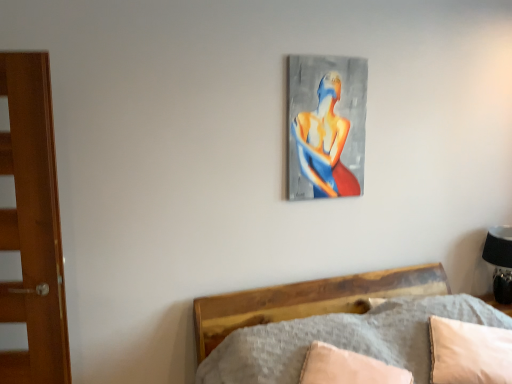
Question: Should I look upward or downward to see abstract painting at upper center?

Choices:
 (A) up
 (B) down

Answer: (A)

Question: Can you confirm if abstract painting at upper center is taller than beige fabric pillow at lower right, arranged as the first pillow when viewed from the left?

Choices:
 (A) yes
 (B) no

Answer: (A)

Question: Considering the relative sizes of abstract painting at upper center and beige fabric pillow at lower right, arranged as the second pillow when viewed from the right, in the image provided, is abstract painting at upper center smaller than beige fabric pillow at lower right, arranged as the second pillow when viewed from the right,?

Choices:
 (A) no
 (B) yes

Answer: (B)

Question: Could you tell me if abstract painting at upper center is turned towards beige fabric pillow at lower right, arranged as the first pillow when viewed from the left?

Choices:
 (A) yes
 (B) no

Answer: (B)

Question: From a real-world perspective, does abstract painting at upper center stand above beige fabric pillow at lower right, arranged as the first pillow when viewed from the left?

Choices:
 (A) no
 (B) yes

Answer: (B)

Question: Is abstract painting at upper center positioned with its back to beige fabric pillow at lower right, arranged as the first pillow when viewed from the left?

Choices:
 (A) no
 (B) yes

Answer: (A)

Question: Is abstract painting at upper center positioned behind beige fabric pillow at lower right, arranged as the first pillow when viewed from the left?

Choices:
 (A) yes
 (B) no

Answer: (A)

Question: Is black matte table lamp at right located within beige fabric pillow at lower right, which is counted as the second pillow, starting from the left?

Choices:
 (A) no
 (B) yes

Answer: (A)

Question: From the image's perspective, is beige fabric pillow at lower right, which is counted as the second pillow, starting from the left, on black matte table lamp at right?

Choices:
 (A) yes
 (B) no

Answer: (B)

Question: Does beige fabric pillow at lower right, which appears as the 1th pillow when viewed from the right, have a lesser height compared to black matte table lamp at right?

Choices:
 (A) no
 (B) yes

Answer: (B)

Question: Is black matte table lamp at right at the back of beige fabric pillow at lower right, which is counted as the second pillow, starting from the left?

Choices:
 (A) yes
 (B) no

Answer: (A)

Question: From the image's perspective, is beige fabric pillow at lower right, which appears as the 1th pillow when viewed from the right, under black matte table lamp at right?

Choices:
 (A) no
 (B) yes

Answer: (B)

Question: From a real-world perspective, is beige fabric pillow at lower right, which appears as the 1th pillow when viewed from the right, physically above black matte table lamp at right?

Choices:
 (A) yes
 (B) no

Answer: (B)

Question: Is black matte table lamp at right positioned before abstract painting at upper center?

Choices:
 (A) yes
 (B) no

Answer: (B)